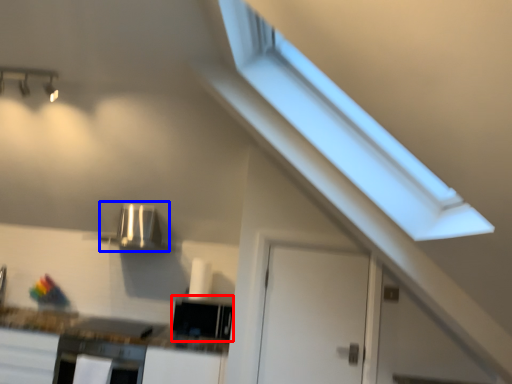
Question: Which point is further to the camera, appliance (highlighted by a red box) or appliance (highlighted by a blue box)?

Choices:
 (A) appliance
 (B) appliance

Answer: (B)